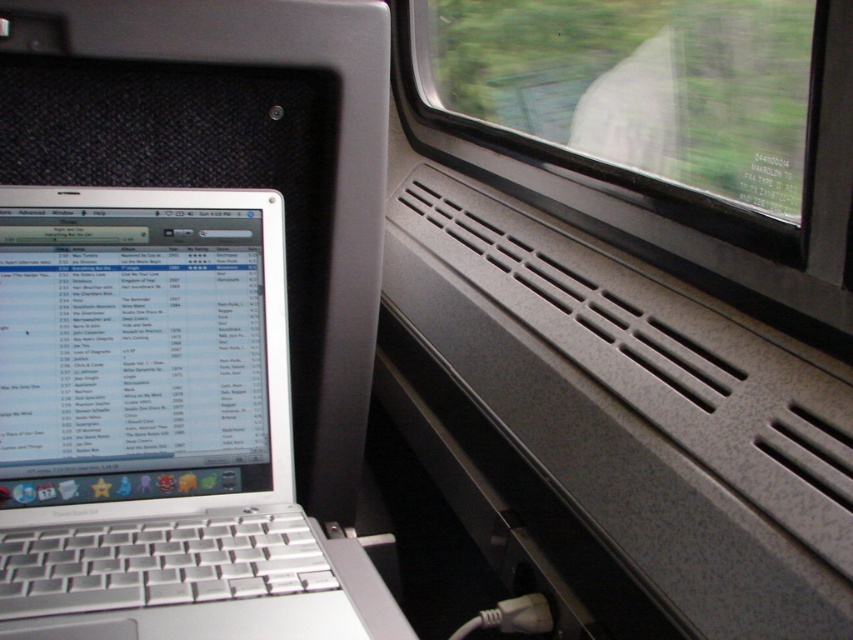
This screenshot has width=853, height=640. Describe the element at coordinates (157, 426) in the screenshot. I see `silver metallic laptop at left` at that location.

Locate an element on the screen. Image resolution: width=853 pixels, height=640 pixels. silver metallic laptop at left is located at coordinates (157, 426).